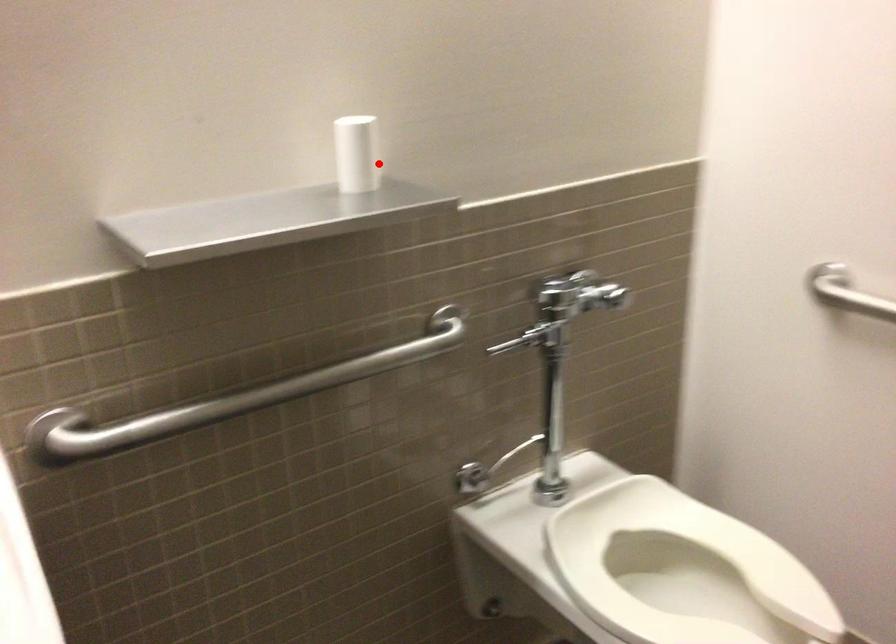
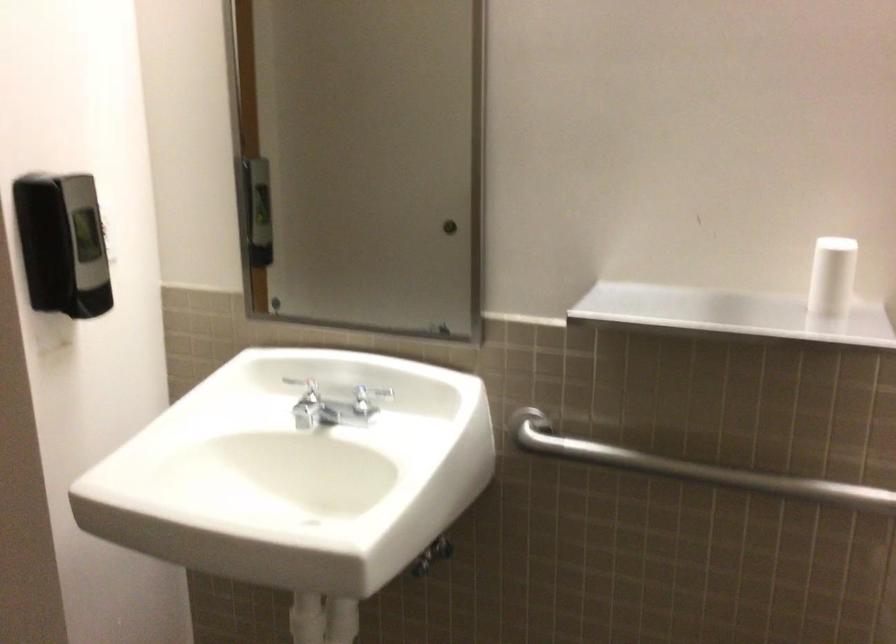
Question: I am providing you with two images of the same scene from different viewpoints. A red point is marked on the first image. At the location where the point appears in image 1, is it still visible in image 2?

Choices:
 (A) Yes
 (B) No

Answer: (A)